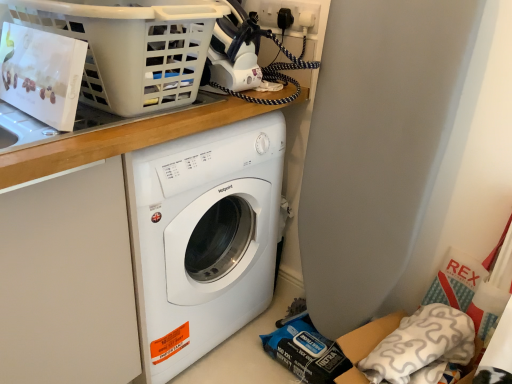
The image size is (512, 384). What do you see at coordinates (131, 49) in the screenshot? I see `white plastic basket at upper left` at bounding box center [131, 49].

At what (x,y) coordinates should I click in order to perform the action: click on white soft pillow at lower right. Please return your answer as a coordinate pair (x, y). Looking at the image, I should click on (422, 347).

The height and width of the screenshot is (384, 512). Find the location of `wooden at upper center`. wooden at upper center is located at coordinates (159, 139).

Find the location of `black plastic plug at upper right`. black plastic plug at upper right is located at coordinates (291, 11).

Visually, is white plastic basket at upper left positioned to the left or to the right of white soft pillow at lower right?

From the image, it's evident that white plastic basket at upper left is to the left of white soft pillow at lower right.

Considering the sizes of objects white plastic basket at upper left and white soft pillow at lower right in the image provided, who is shorter, white plastic basket at upper left or white soft pillow at lower right?

white plastic basket at upper left is shorter.

Are white plastic basket at upper left and white soft pillow at lower right making contact?

They are not placed beside each other.

In terms of height, does white plastic basket at upper left look taller or shorter compared to black plastic plug at upper right?

Considering their sizes, white plastic basket at upper left has more height than black plastic plug at upper right.

Are white plastic basket at upper left and black plastic plug at upper right making contact?

white plastic basket at upper left is not next to black plastic plug at upper right, and they're not touching.

From a real-world perspective, who is located lower, white plastic basket at upper left or black plastic plug at upper right?

From a 3D spatial view, white plastic basket at upper left is below.

From the image's perspective, between white plastic basket at upper left and black plastic plug at upper right, which one is located above?

black plastic plug at upper right, from the image's perspective.

In the scene shown: Is white soft pillow at lower right far from black plastic plug at upper right?

No, white soft pillow at lower right is not far away from black plastic plug at upper right.

From the picture: Is white soft pillow at lower right to the right of black plastic plug at upper right from the viewer's perspective?

Yes.

Consider the image. Which is correct: white soft pillow at lower right is inside black plastic plug at upper right, or outside of it?

The correct answer is: outside.

From a real-world perspective, which is physically above, white soft pillow at lower right or black plastic plug at upper right?

black plastic plug at upper right is physically above.

Is wooden at upper center to the left or to the right of white plastic basket at upper left in the image?

In the image, wooden at upper center appears on the right side of white plastic basket at upper left.

Looking at this image, considering the sizes of objects wooden at upper center and white plastic basket at upper left in the image provided, who is wider, wooden at upper center or white plastic basket at upper left?

Wider between the two is white plastic basket at upper left.

How different are the orientations of wooden at upper center and white plastic basket at upper left in degrees?

The facing directions of wooden at upper center and white plastic basket at upper left are 0.593 degrees apart.

From a real-world perspective, relative to white plastic basket at upper left, is wooden at upper center vertically above or below?

wooden at upper center is below white plastic basket at upper left.

Is wooden at upper center in contact with black plastic plug at upper right?

No, wooden at upper center is not with black plastic plug at upper right.

Which is more to the right, wooden at upper center or black plastic plug at upper right?

black plastic plug at upper right is more to the right.

Is wooden at upper center positioned beyond the bounds of black plastic plug at upper right?

Indeed, wooden at upper center is completely outside black plastic plug at upper right.

From the image's perspective, is wooden at upper center over black plastic plug at upper right?

No, from the image's perspective, wooden at upper center is not on top of black plastic plug at upper right.

Which of these two, black plastic plug at upper right or white soft pillow at lower right, is wider?

white soft pillow at lower right.

Which of these two, black plastic plug at upper right or white soft pillow at lower right, stands shorter?

black plastic plug at upper right is shorter.

Which is in front, point (261, 11) or point (381, 345)?

The point (381, 345) is in front.

Considering the relative positions of black plastic plug at upper right and white soft pillow at lower right in the image provided, is black plastic plug at upper right in front of white soft pillow at lower right?

No, black plastic plug at upper right is further to the viewer.

Is wooden at upper center inside or outside of white soft pillow at lower right?

The correct answer is: outside.

Which of these two, wooden at upper center or white soft pillow at lower right, stands taller?

wooden at upper center is taller.

Consider the image. Between wooden at upper center and white soft pillow at lower right, which one appears on the left side from the viewer's perspective?

wooden at upper center.

Considering the relative sizes of wooden at upper center and white soft pillow at lower right in the image provided, is wooden at upper center thinner than white soft pillow at lower right?

In fact, wooden at upper center might be wider than white soft pillow at lower right.

The height and width of the screenshot is (384, 512). What are the coordinates of `pillow on the right of white plastic basket at upper left` in the screenshot? It's located at (422, 347).

At what (x,y) coordinates should I click in order to perform the action: click on basket in front of the black plastic plug at upper right. Please return your answer as a coordinate pair (x, y). Image resolution: width=512 pixels, height=384 pixels. Looking at the image, I should click on (131, 49).

Estimate the real-world distances between objects in this image. Which object is closer to black plastic plug at upper right, white soft pillow at lower right or wooden at upper center?

wooden at upper center lies closer to black plastic plug at upper right than the other object.

Considering their positions, is wooden at upper center positioned further to white plastic basket at upper left than black plastic plug at upper right?

black plastic plug at upper right is positioned further to the anchor white plastic basket at upper left.

From the picture: When comparing their distances from black plastic plug at upper right, does white plastic basket at upper left or wooden at upper center seem closer?

wooden at upper center is closer to black plastic plug at upper right.

Looking at the image, which one is located further to wooden at upper center, black plastic plug at upper right or white soft pillow at lower right?

Among the two, white soft pillow at lower right is located further to wooden at upper center.

Estimate the real-world distances between objects in this image. Which object is closer to wooden at upper center, white plastic basket at upper left or black plastic plug at upper right?

white plastic basket at upper left.

Which object lies nearer to the anchor point white soft pillow at lower right, black plastic plug at upper right or wooden at upper center?

wooden at upper center is closer to white soft pillow at lower right.

Estimate the real-world distances between objects in this image. Which object is closer to black plastic plug at upper right, wooden at upper center or white plastic basket at upper left?

Among the two, wooden at upper center is located nearer to black plastic plug at upper right.

From the image, which object appears to be nearer to white soft pillow at lower right, wooden at upper center or black plastic plug at upper right?

wooden at upper center is positioned closer to the anchor white soft pillow at lower right.

Locate an element on the screen. This screenshot has width=512, height=384. basket that lies between black plastic plug at upper right and white soft pillow at lower right from top to bottom is located at coordinates (131, 49).

The height and width of the screenshot is (384, 512). I want to click on basket that lies between black plastic plug at upper right and wooden at upper center from top to bottom, so click(131, 49).

Locate an element on the screen. Image resolution: width=512 pixels, height=384 pixels. counter top that lies between black plastic plug at upper right and white soft pillow at lower right from top to bottom is located at coordinates (159, 139).

At what (x,y) coordinates should I click in order to perform the action: click on counter top between white plastic basket at upper left and white soft pillow at lower right in the up-down direction. Please return your answer as a coordinate pair (x, y). This screenshot has width=512, height=384. Looking at the image, I should click on (159, 139).